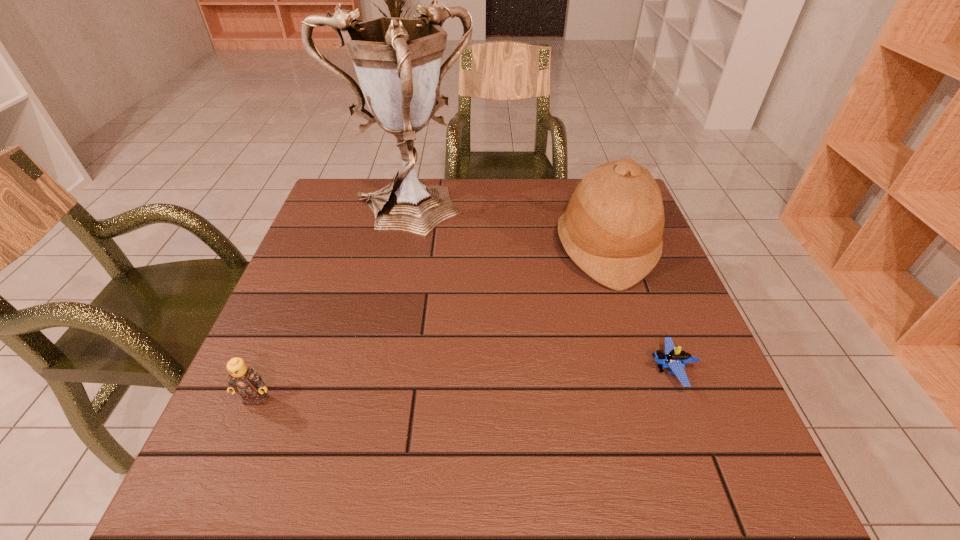
I want to click on blank space located in front of the taller Lego, so click(x=215, y=497).

At what (x,y) coordinates should I click in order to perform the action: click on vacant area situated on the front-facing side of the right Lego. Please return your answer as a coordinate pair (x, y). The height and width of the screenshot is (540, 960). Looking at the image, I should click on (570, 371).

I want to click on vacant region located on the front-facing side of the right Lego, so click(x=612, y=371).

Locate an element on the screen. vacant space located on the front-facing side of the right Lego is located at coordinates (576, 371).

This screenshot has height=540, width=960. I want to click on trophy cup positioned at the far edge, so click(x=397, y=60).

This screenshot has height=540, width=960. I want to click on hat that is at the far edge, so click(x=612, y=229).

Find the location of a particular element. The height and width of the screenshot is (540, 960). trophy cup situated at the left edge is located at coordinates (397, 60).

Identify the location of Lego at the left edge. point(244,380).

Find the location of `hat that is at the right edge`. hat that is at the right edge is located at coordinates (612, 229).

Image resolution: width=960 pixels, height=540 pixels. I want to click on Lego positioned at the right edge, so click(674, 358).